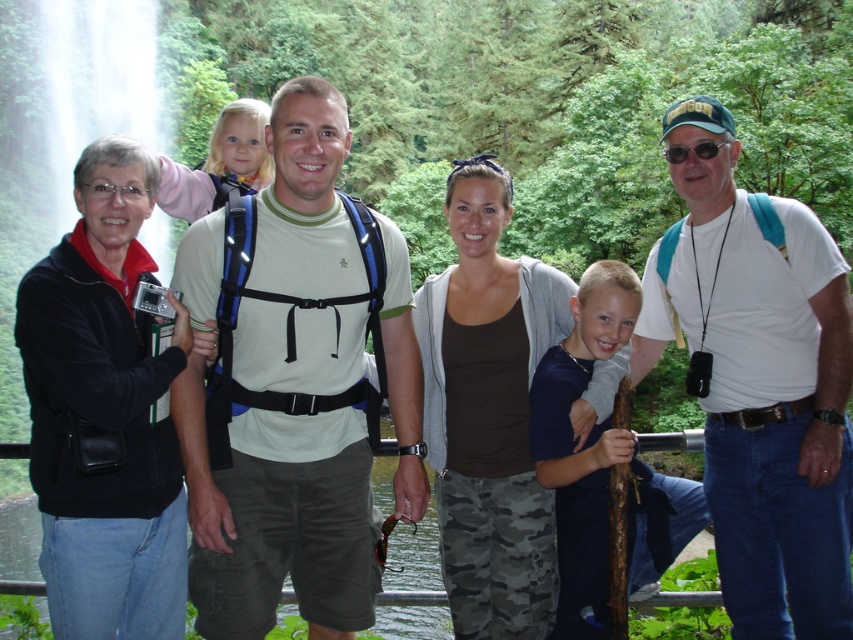
Is matte white t-shirt at center closer to the viewer compared to white cotton t-shirt at center?

No, matte white t-shirt at center is further to the viewer.

Consider the image. Which of these two, matte white t-shirt at center or white cotton t-shirt at center, stands taller?

Standing taller between the two is matte white t-shirt at center.

Image resolution: width=853 pixels, height=640 pixels. In order to click on matte white t-shirt at center in this screenshot , I will do `click(289, 403)`.

Is point (229, 429) positioned after point (96, 513)?

That is True.

Does matte white t-shirt at center have a smaller size compared to black leather jacket at left?

Actually, matte white t-shirt at center might be larger than black leather jacket at left.

What do you see at coordinates (289, 403) in the screenshot? This screenshot has width=853, height=640. I see `matte white t-shirt at center` at bounding box center [289, 403].

Identify the location of matte white t-shirt at center. Image resolution: width=853 pixels, height=640 pixels. (289, 403).

How far apart are white cotton t-shirt at center and black leather jacket at left?

A distance of 2.63 meters exists between white cotton t-shirt at center and black leather jacket at left.

Is point (834, 390) farther from viewer compared to point (141, 170)?

Yes, point (834, 390) is farther from viewer.

Is point (740, 464) positioned behind point (167, 508)?

Yes, it is.

This screenshot has height=640, width=853. In order to click on white cotton t-shirt at center in this screenshot , I will do `click(759, 381)`.